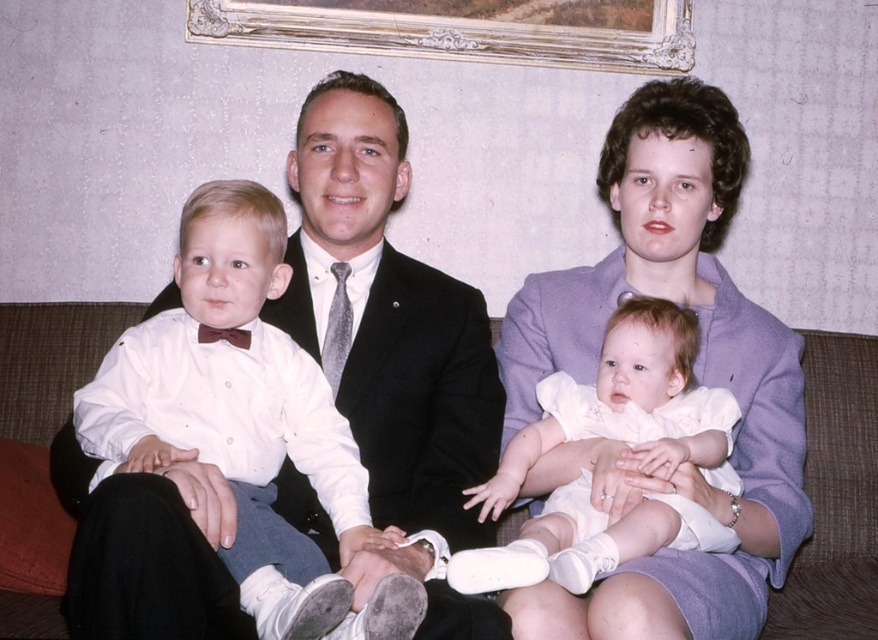
You are standing 5 feet away from the sofa where the family is seated. You want to hand a gift to the person wearing the purple fabric dress at center. Can you reach them without moving closer?

The purple fabric dress at center is 3.82 feet away from the viewer. Since you are standing 5 feet away, you are too far to reach them without moving closer.

You are planning to arrange two items on a shelf. You have a matte black suit at center and a white satin dress at center. Given their sizes, which one should you place first to maximize shelf space?

The matte black suit at center has a larger width than the white satin dress at center, so you should place the matte black suit at center first to efficiently utilize the shelf space.